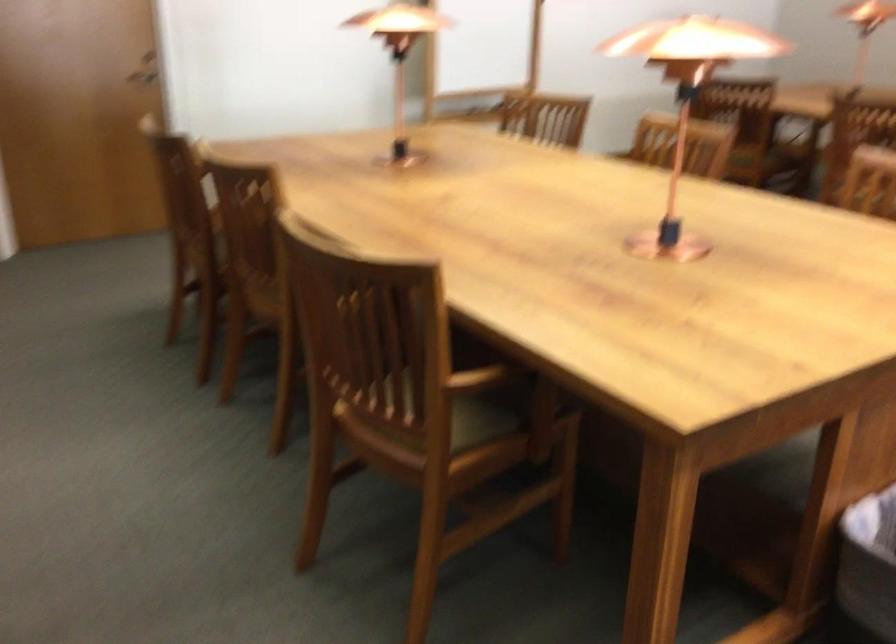
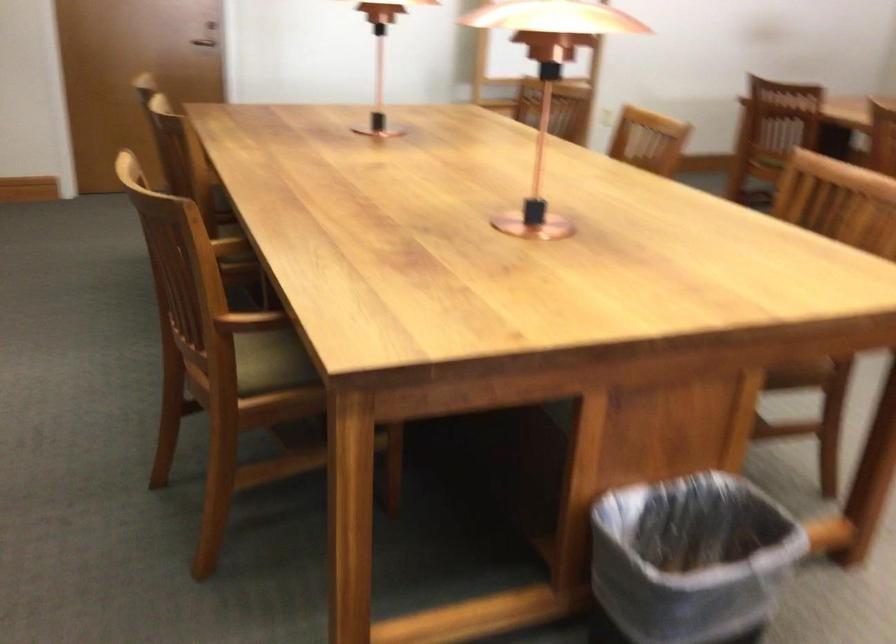
Find the pixel in the second image that matches point (479, 381) in the first image.

(250, 321)